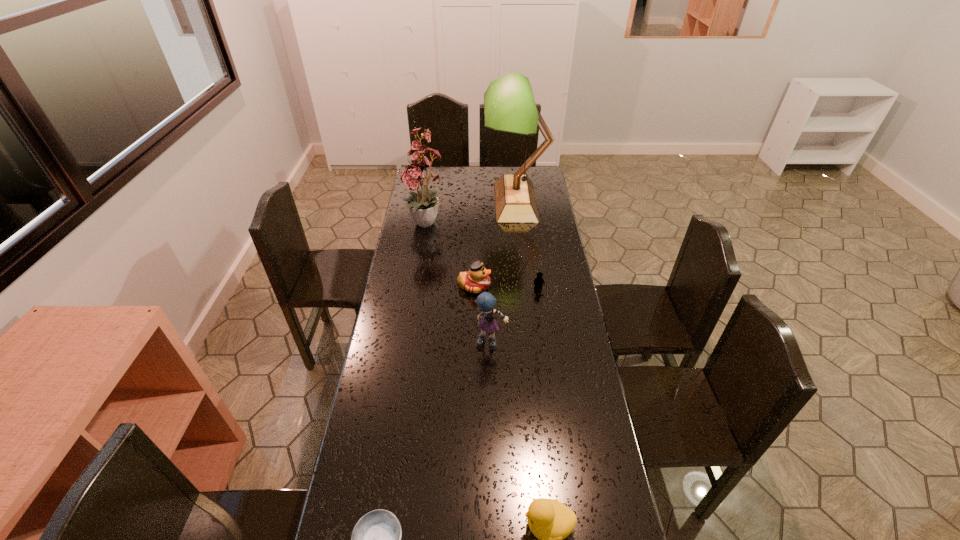
Locate an element on the screen. This screenshot has width=960, height=540. free spot located 0.400m on the front-facing side of the fifth shortest object is located at coordinates (493, 463).

Image resolution: width=960 pixels, height=540 pixels. Identify the location of blank space located 0.320m on the face of the left duck. (569, 286).

Image resolution: width=960 pixels, height=540 pixels. In order to click on vacant space positioned 0.260m on the front-facing side of the Lego in this screenshot , I will do `click(545, 341)`.

Image resolution: width=960 pixels, height=540 pixels. I want to click on object located in the far edge section of the desktop, so click(x=509, y=106).

The image size is (960, 540). I want to click on object that is positioned at the left edge, so click(423, 205).

This screenshot has width=960, height=540. Identify the location of table lamp that is at the right edge. (509, 106).

Where is `Lego that is at the right edge`? Image resolution: width=960 pixels, height=540 pixels. Lego that is at the right edge is located at coordinates (538, 281).

Identify the location of object located at the far right corner. The height and width of the screenshot is (540, 960). (509, 106).

In the image, there is a desktop. Where is `vacant space at the far edge`? vacant space at the far edge is located at coordinates (467, 175).

At what (x,y) coordinates should I click in order to perform the action: click on free space at the left edge. Please return your answer as a coordinate pair (x, y). The width and height of the screenshot is (960, 540). Looking at the image, I should click on coord(387,332).